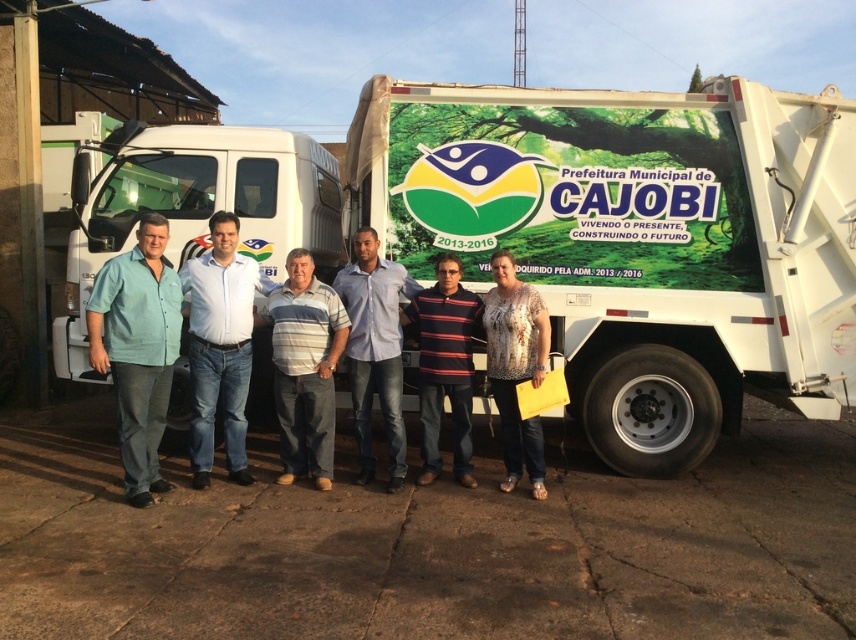
Question: Can you confirm if white glossy garbage truck at center is smaller than printed floral blouse at center?

Choices:
 (A) yes
 (B) no

Answer: (B)

Question: Which of the following is the closest to the observer?

Choices:
 (A) striped knit sweater at center
 (B) teal matte shirt at left
 (C) white glossy garbage truck at left

Answer: (B)

Question: Estimate the real-world distances between objects in this image. Which object is farther from the light blue shirt at center?

Choices:
 (A) striped cotton shirt at center
 (B) striped knit sweater at center
 (C) blue shirt at center

Answer: (C)

Question: Which point is farther to the camera?

Choices:
 (A) light blue shirt at center
 (B) printed floral blouse at center
 (C) white glossy garbage truck at center
 (D) blue shirt at center

Answer: (C)

Question: Can you confirm if blue shirt at center is positioned to the right of striped knit sweater at center?

Choices:
 (A) no
 (B) yes

Answer: (A)

Question: Can you confirm if white glossy garbage truck at center is positioned above teal matte shirt at left?

Choices:
 (A) no
 (B) yes

Answer: (B)